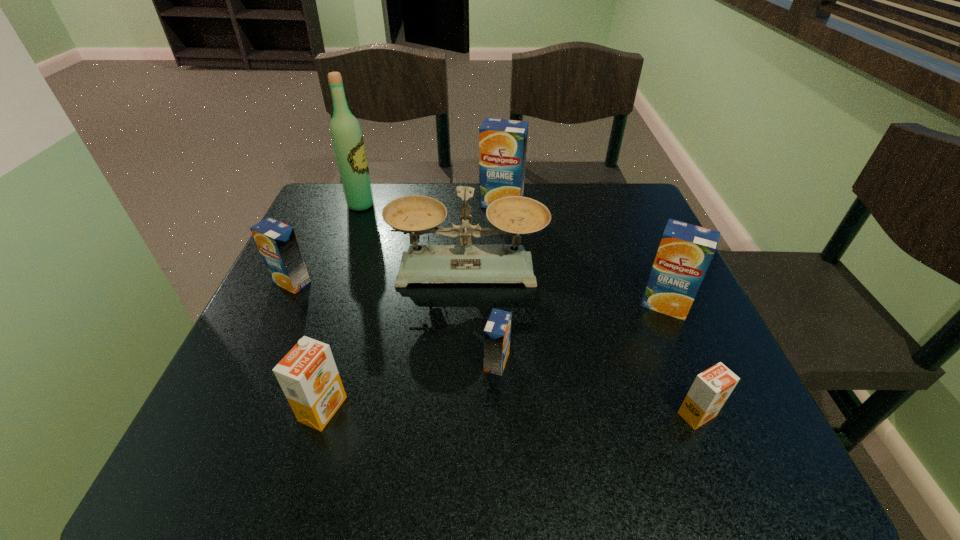
The height and width of the screenshot is (540, 960). Identify the location of object that ranks as the seventh closest to the farthest blue orange_juice. click(711, 388).

Select which object appears as the third closest to the fourth farthest orange juice. Please provide its 2D coordinates. Your answer should be formatted as a tuple, i.e. [(x, y)], where the tuple contains the x and y coordinates of a point satisfying the conditions above.

[(711, 388)]

Locate an element on the screen. orange juice that is the third nearest to the smaller orange orange juice is located at coordinates (308, 376).

Identify which orange juice is the fourth nearest to the fifth orange juice from right to left. Please provide its 2D coordinates. Your answer should be formatted as a tuple, i.e. [(x, y)], where the tuple contains the x and y coordinates of a point satisfying the conditions above.

[(685, 251)]

I want to click on blue orange_juice that is the closest one to the leftmost object, so click(497, 332).

Select which blue orange_juice is the closest to the leftmost object. Please provide its 2D coordinates. Your answer should be formatted as a tuple, i.e. [(x, y)], where the tuple contains the x and y coordinates of a point satisfying the conditions above.

[(497, 332)]

Identify the location of blank space that satisfies the following two spatial constraints: 1. on the front-facing side of the second biggest blue orange_juice; 2. on the right side of the white wine bottle. (324, 304).

The height and width of the screenshot is (540, 960). In order to click on free spot that satisfies the following two spatial constraints: 1. on the back side of the smallest blue orange_juice; 2. on the right side of the biggest blue orange_juice in this screenshot , I will do `click(492, 203)`.

Image resolution: width=960 pixels, height=540 pixels. I want to click on vacant space that satisfies the following two spatial constraints: 1. on the front-facing side of the wine bottle; 2. on the left side of the rightmost blue orange_juice, so click(x=324, y=304).

Where is `vacant space that satisfies the following two spatial constraints: 1. on the front-facing side of the scale; 2. on the right side of the smaller orange orange juice`? vacant space that satisfies the following two spatial constraints: 1. on the front-facing side of the scale; 2. on the right side of the smaller orange orange juice is located at coordinates (464, 414).